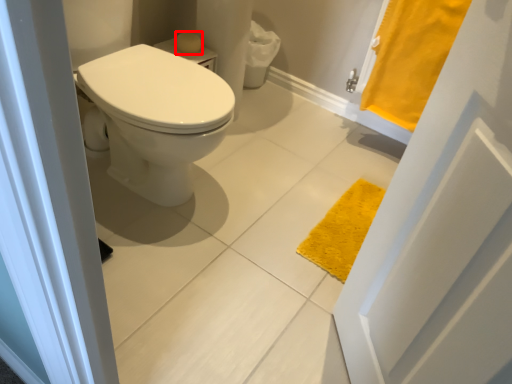
Question: From the image's perspective, what is the correct spatial relationship of soap (annotated by the red box) in relation to bath towel?

Choices:
 (A) below
 (B) above

Answer: (B)